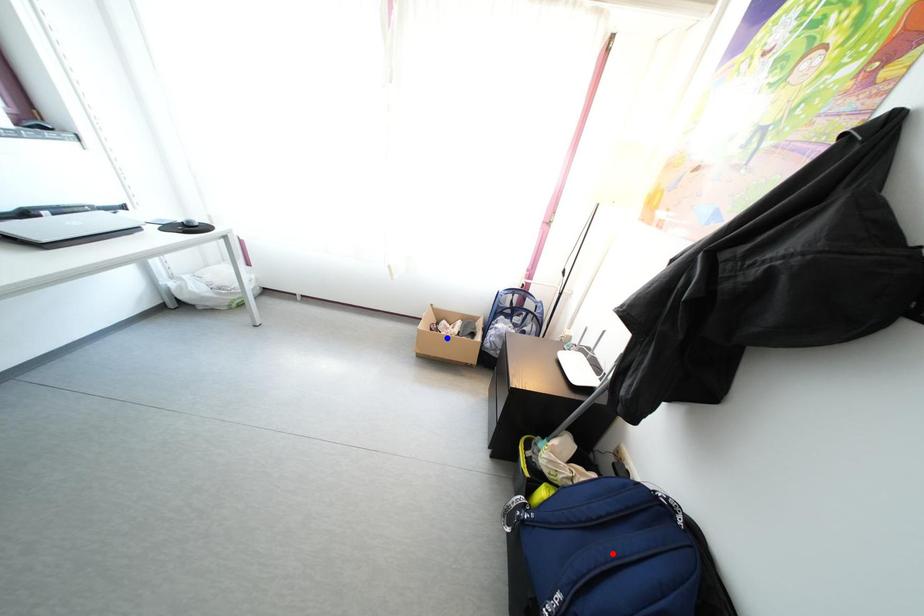
Question: Two points are marked on the image. Which point is closer to the camera?

Choices:
 (A) Blue point is closer.
 (B) Red point is closer.

Answer: (B)